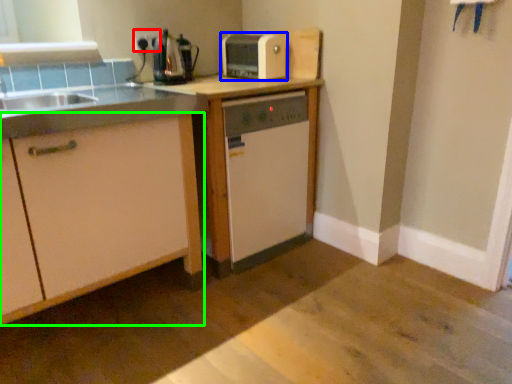
Question: Estimate the real-world distances between objects in this image. Which object is farther from electric outlet (highlighted by a red box), kitchen appliance (highlighted by a blue box) or cabinetry (highlighted by a green box)?

Choices:
 (A) kitchen appliance
 (B) cabinetry

Answer: (B)